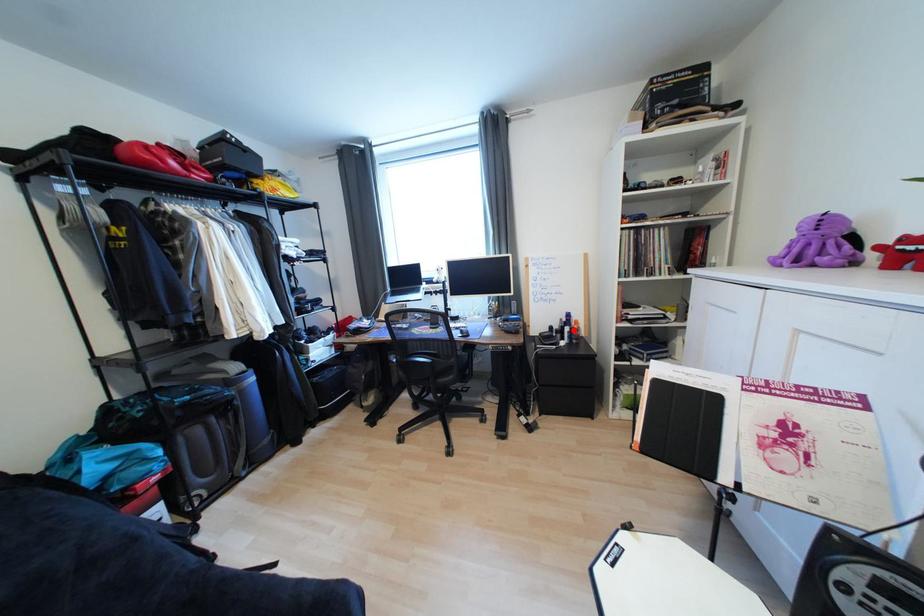
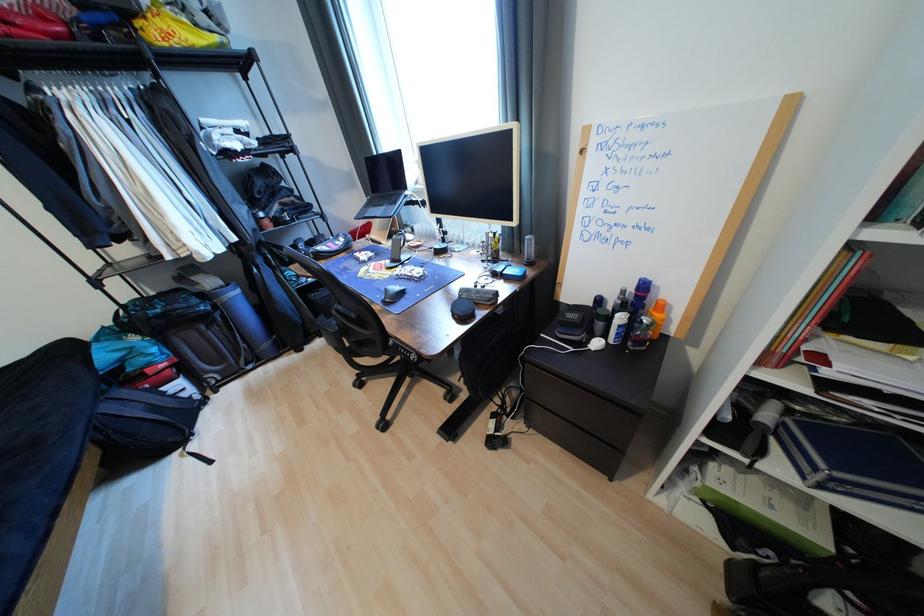
Find the pixel in the second image that matches the highlighted location in the first image.

(627, 320)